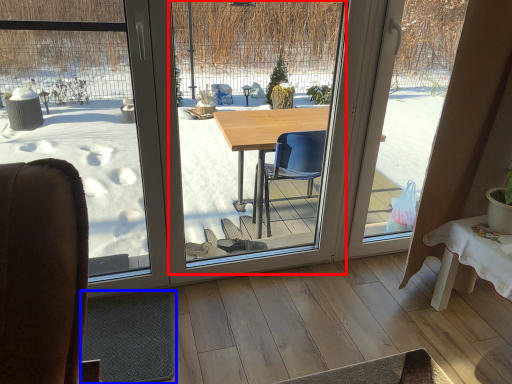
Question: Which point is closer to the camera, window screen (highlighted by a red box) or flat (highlighted by a blue box)?

Choices:
 (A) window screen
 (B) flat

Answer: (A)